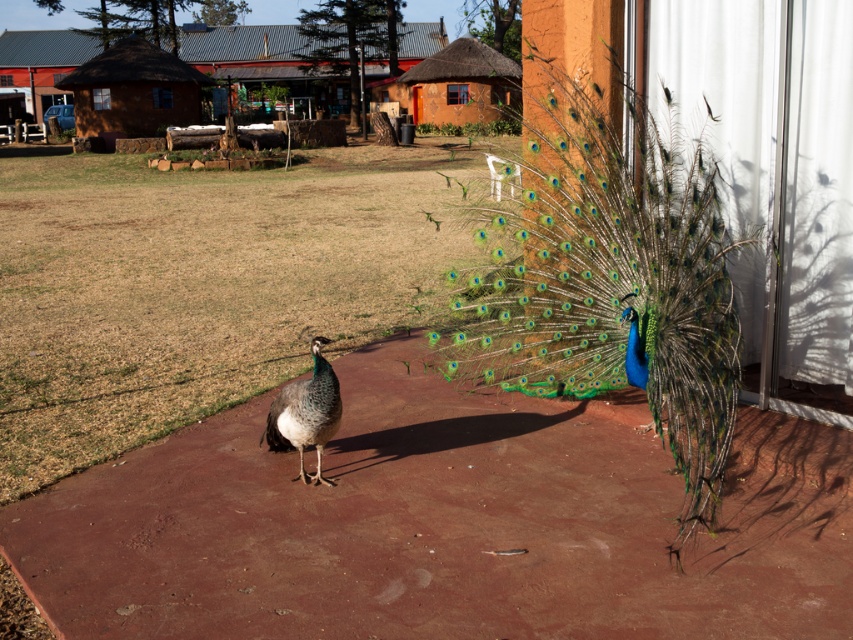
Question: Which point is farther from the camera taking this photo?

Choices:
 (A) (144, 83)
 (B) (274, 435)

Answer: (A)

Question: Which point is farther from the camera taking this photo?

Choices:
 (A) (315, 412)
 (B) (416, 81)
 (C) (94, 81)

Answer: (B)

Question: Which point is farther to the camera?

Choices:
 (A) (547, 358)
 (B) (471, 38)
 (C) (318, 417)
 (D) (265, 428)

Answer: (B)

Question: Can you confirm if shiny blue peacock at center is thinner than terracotta thatched hut at center?

Choices:
 (A) no
 (B) yes

Answer: (A)

Question: Is shiny green peacock at center positioned behind shiny metallic tail at center?

Choices:
 (A) yes
 (B) no

Answer: (B)

Question: Is brown thatched hut at upper left closer to camera compared to terracotta thatched hut at center?

Choices:
 (A) no
 (B) yes

Answer: (B)